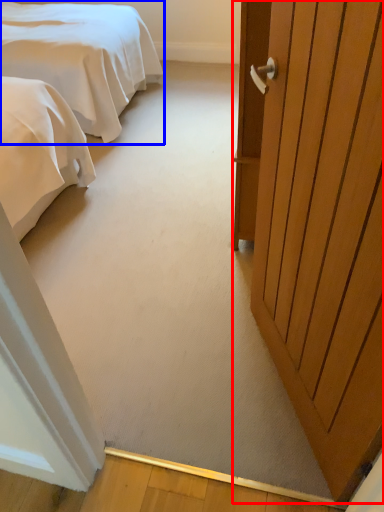
Question: Which object appears farthest to the camera in this image, door (highlighted by a red box) or bed (highlighted by a blue box)?

Choices:
 (A) door
 (B) bed

Answer: (B)